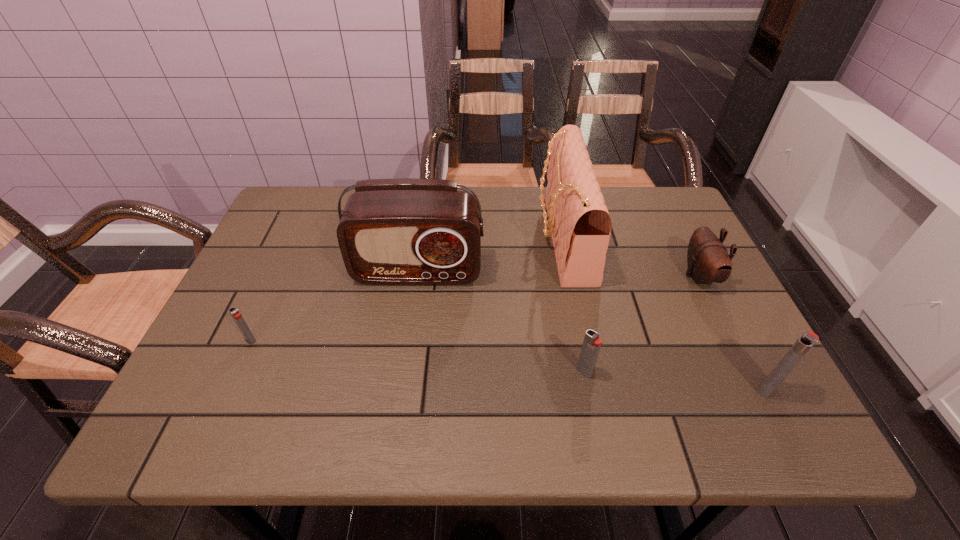
This screenshot has height=540, width=960. What are the coordinates of `object present at the left edge` in the screenshot? It's located at tap(234, 312).

Find the location of a particular element. This screenshot has width=960, height=540. igniter that is at the right edge is located at coordinates (808, 339).

At what (x,y) coordinates should I click in order to perform the action: click on pouch located at the right edge. Please return your answer as a coordinate pair (x, y). The height and width of the screenshot is (540, 960). Looking at the image, I should click on (708, 260).

You are a GUI agent. You are given a task and a screenshot of the screen. Output one action in this format:
    pyautogui.click(x=<x>, y=<y>)
    Task: Click on the object that is at the near right corner
    Image resolution: width=960 pixels, height=540 pixels.
    Given the screenshot: What is the action you would take?
    pyautogui.click(x=808, y=339)

This screenshot has width=960, height=540. In order to click on blank space at the far edge of the desktop in this screenshot , I will do `click(521, 212)`.

Find the location of `vacant space at the near edge of the desktop`. vacant space at the near edge of the desktop is located at coordinates (345, 380).

In the image, there is a desktop. Identify the location of free space at the right edge. This screenshot has height=540, width=960. (716, 342).

In the image, there is a desktop. Identify the location of blank space at the near left corner. (225, 360).

Where is `unoccupied area between the pouch and the second farthest igniter`? The width and height of the screenshot is (960, 540). unoccupied area between the pouch and the second farthest igniter is located at coordinates (642, 324).

Locate an element on the screen. The image size is (960, 540). vacant space that is in between the rightmost igniter and the second igniter from left to right is located at coordinates (676, 381).